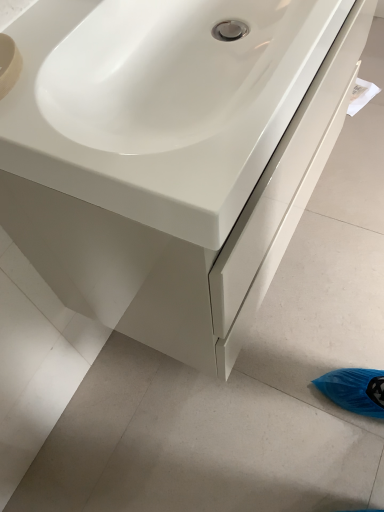
This screenshot has height=512, width=384. Describe the element at coordinates (188, 241) in the screenshot. I see `white glossy cabinet at center` at that location.

Where is `white glossy cabinet at center`? This screenshot has height=512, width=384. white glossy cabinet at center is located at coordinates (188, 241).

Measure the distance between white glossy cabinet at center and camera.

The distance of white glossy cabinet at center from camera is 15.98 inches.

Identify the location of white glossy cabinet at center. Image resolution: width=384 pixels, height=512 pixels. (188, 241).